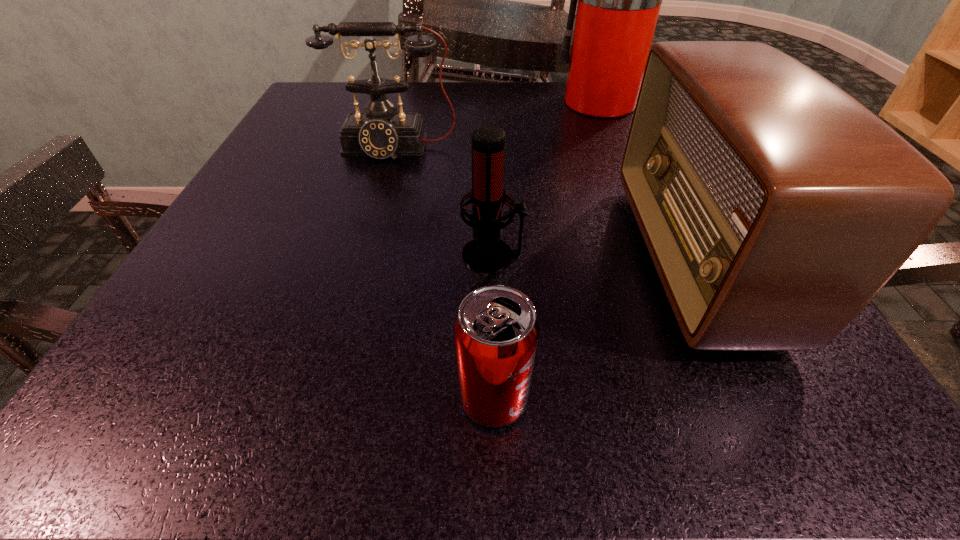
Find the location of a particular element. Image resolution: width=960 pixels, height=540 pixels. vacant space located on the front-facing side of the radio receiver is located at coordinates (570, 259).

Find the location of a particular element. This screenshot has height=540, width=960. free space located on the front-facing side of the radio receiver is located at coordinates (591, 259).

Identify the location of free region located 0.170m on the front-facing side of the radio receiver. The image size is (960, 540). (520, 259).

Where is `vacant space located on the dial of the telephone`? This screenshot has height=540, width=960. vacant space located on the dial of the telephone is located at coordinates pos(354,289).

Find the location of a particular element. vacant space located 0.290m on the right of the microphone is located at coordinates (728, 255).

Locate an element on the screen. The width and height of the screenshot is (960, 540). free space located 0.400m on the back of the shortest object is located at coordinates (489, 174).

At what (x,y) coordinates should I click in order to perform the action: click on object present at the far edge. Please return your answer as a coordinate pair (x, y). Image resolution: width=960 pixels, height=540 pixels. Looking at the image, I should click on (619, 0).

At what (x,y) coordinates should I click in order to perform the action: click on radio receiver that is at the near edge. Please return your answer as a coordinate pair (x, y). This screenshot has height=540, width=960. Looking at the image, I should click on (775, 206).

You are a GUI agent. You are given a task and a screenshot of the screen. Output one action in this format:
    pyautogui.click(x=<x>, y=<y>)
    Task: Click on the soda can present at the near edge
    The height and width of the screenshot is (540, 960).
    Given the screenshot: What is the action you would take?
    pyautogui.click(x=496, y=332)

Where is `object that is at the left edge`? This screenshot has height=540, width=960. object that is at the left edge is located at coordinates (380, 132).